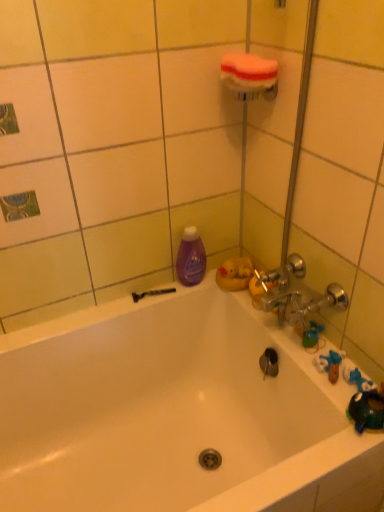
Question: From the image's perspective, is white glossy bathtub at center beneath green rubber toy at right?

Choices:
 (A) no
 (B) yes

Answer: (B)

Question: Is white glossy bathtub at center oriented towards green rubber toy at right?

Choices:
 (A) no
 (B) yes

Answer: (A)

Question: Is white glossy bathtub at center not near green rubber toy at right?

Choices:
 (A) no
 (B) yes

Answer: (A)

Question: Does white glossy bathtub at center appear on the left side of green rubber toy at right?

Choices:
 (A) yes
 (B) no

Answer: (A)

Question: From a real-world perspective, is white glossy bathtub at center on top of green rubber toy at right?

Choices:
 (A) no
 (B) yes

Answer: (A)

Question: Is green rubber toy at right at the back of white glossy bathtub at center?

Choices:
 (A) yes
 (B) no

Answer: (B)

Question: From a real-world perspective, is purple glossy bottle at upper left located higher than orange sponge at upper center?

Choices:
 (A) yes
 (B) no

Answer: (B)

Question: Considering the relative sizes of purple glossy bottle at upper left and orange sponge at upper center in the image provided, is purple glossy bottle at upper left wider than orange sponge at upper center?

Choices:
 (A) no
 (B) yes

Answer: (A)

Question: Does purple glossy bottle at upper left contain orange sponge at upper center?

Choices:
 (A) no
 (B) yes

Answer: (A)

Question: Is purple glossy bottle at upper left aimed at orange sponge at upper center?

Choices:
 (A) yes
 (B) no

Answer: (B)

Question: Does purple glossy bottle at upper left have a larger size compared to orange sponge at upper center?

Choices:
 (A) yes
 (B) no

Answer: (A)

Question: Can you confirm if purple glossy bottle at upper left is thinner than orange sponge at upper center?

Choices:
 (A) no
 (B) yes

Answer: (B)

Question: Is orange sponge at upper center at the back of black plastic razor at lower left?

Choices:
 (A) yes
 (B) no

Answer: (B)